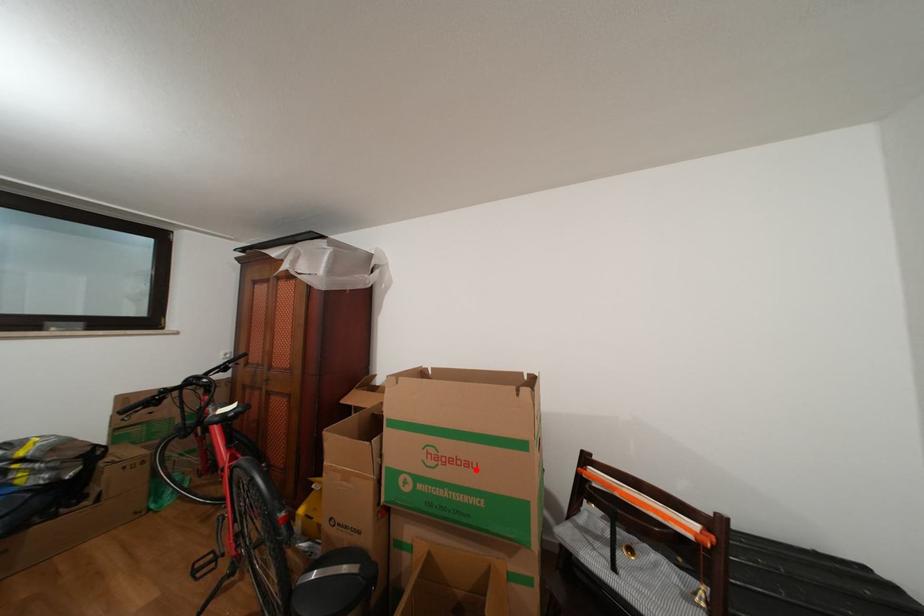
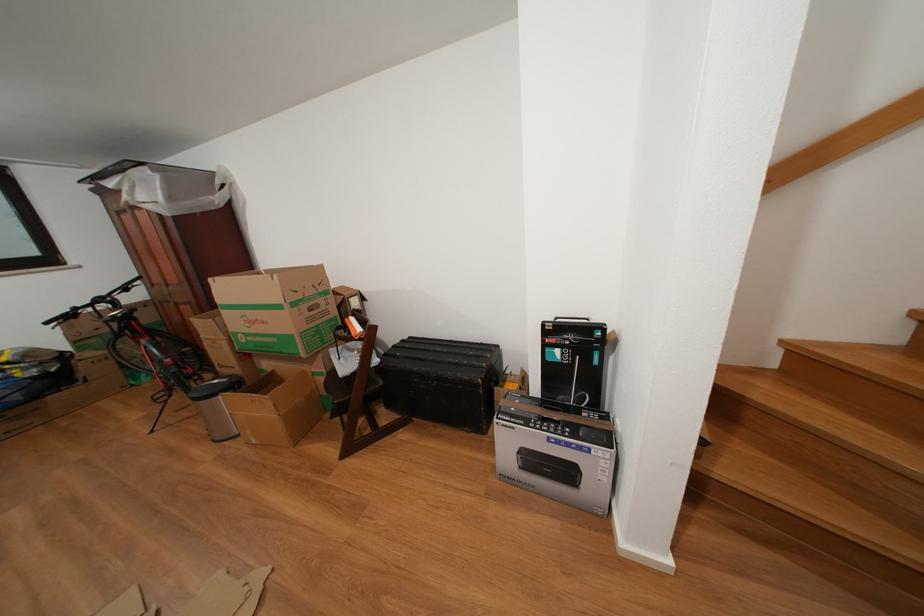
Locate, in the second image, the point that corresponds to the highlighted location in the first image.

(272, 328)